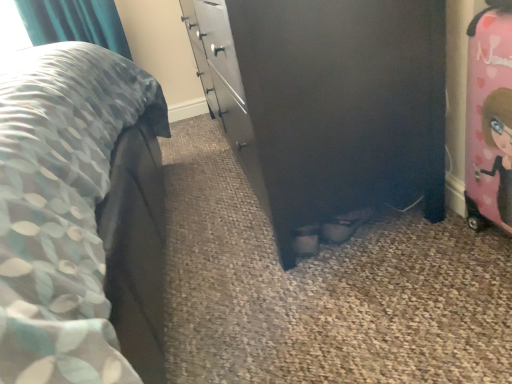
Question: Does pink glossy suitcase at right have a greater width compared to black matte chest of drawers at center?

Choices:
 (A) no
 (B) yes

Answer: (A)

Question: From a real-world perspective, is pink glossy suitcase at right under black matte chest of drawers at center?

Choices:
 (A) no
 (B) yes

Answer: (B)

Question: Is black matte chest of drawers at center located within pink glossy suitcase at right?

Choices:
 (A) yes
 (B) no

Answer: (B)

Question: Does pink glossy suitcase at right appear on the right side of black matte chest of drawers at center?

Choices:
 (A) no
 (B) yes

Answer: (B)

Question: Does pink glossy suitcase at right have a smaller size compared to black matte chest of drawers at center?

Choices:
 (A) no
 (B) yes

Answer: (B)

Question: Does pink glossy suitcase at right touch black matte chest of drawers at center?

Choices:
 (A) yes
 (B) no

Answer: (B)

Question: Is black matte chest of drawers at center at the left side of pink glossy suitcase at right?

Choices:
 (A) no
 (B) yes

Answer: (B)

Question: Does black matte chest of drawers at center have a smaller size compared to pink glossy suitcase at right?

Choices:
 (A) no
 (B) yes

Answer: (A)

Question: Can you confirm if black matte chest of drawers at center is shorter than pink glossy suitcase at right?

Choices:
 (A) yes
 (B) no

Answer: (B)

Question: Is black matte chest of drawers at center placed right next to pink glossy suitcase at right?

Choices:
 (A) yes
 (B) no

Answer: (B)

Question: Is the depth of black matte chest of drawers at center greater than that of pink glossy suitcase at right?

Choices:
 (A) yes
 (B) no

Answer: (A)

Question: From a real-world perspective, is black matte chest of drawers at center positioned over pink glossy suitcase at right based on gravity?

Choices:
 (A) no
 (B) yes

Answer: (B)

Question: Considering the positions of black matte chest of drawers at center and pink glossy suitcase at right in the image, is black matte chest of drawers at center bigger or smaller than pink glossy suitcase at right?

Choices:
 (A) small
 (B) big

Answer: (B)